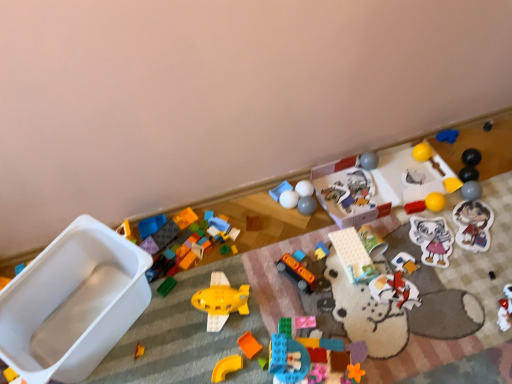
Locate an element on the screen. This screenshot has height=384, width=512. free space between yellow matte square at center-right, placed as the 22th toy when sorted from left to right, and orange matte block at center, which is the twentieth toy from right to left is located at coordinates (361, 259).